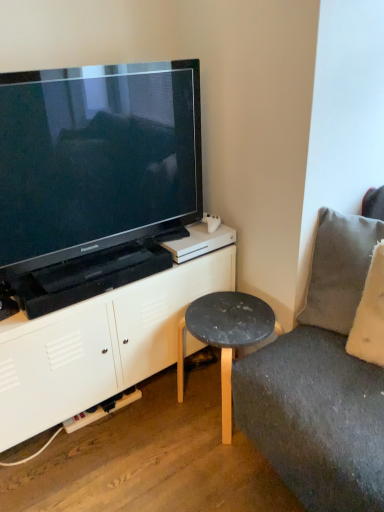
Question: Is white matte cabinet at lower left situated inside black glossy television at upper left or outside?

Choices:
 (A) inside
 (B) outside

Answer: (B)

Question: Would you say white matte cabinet at lower left is to the left or to the right of black glossy television at upper left in the picture?

Choices:
 (A) left
 (B) right

Answer: (A)

Question: Which object is positioned farthest from the black glossy television at upper left?

Choices:
 (A) white matte cabinet at lower left
 (B) matte black stool at lower center
 (C) gray fabric pillow at right

Answer: (C)

Question: Which object is positioned closest to the matte black stool at lower center?

Choices:
 (A) gray fabric pillow at right
 (B) black glossy television at upper left
 (C) white matte cabinet at lower left

Answer: (C)